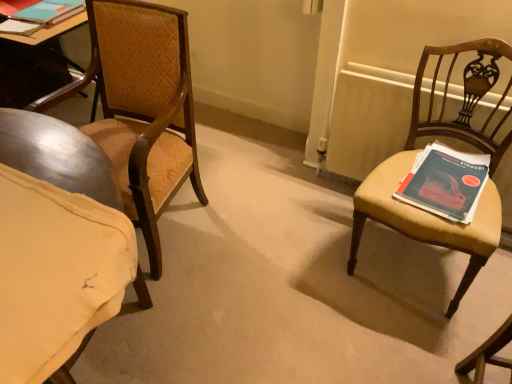
Where is `vacant space to the left of wooden radiator at right`? The height and width of the screenshot is (384, 512). vacant space to the left of wooden radiator at right is located at coordinates (293, 223).